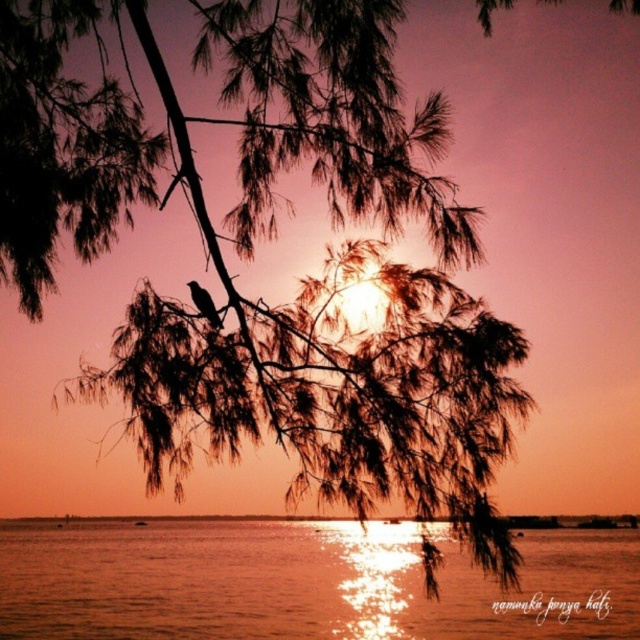
Question: Among these objects, which one is farthest from the camera?

Choices:
 (A) brown feathered bird at upper left
 (B) shiny reflective water at center

Answer: (A)

Question: Is shiny reflective water at center below brown feathered bird at upper left?

Choices:
 (A) no
 (B) yes

Answer: (B)

Question: Can you confirm if shiny reflective water at center is thinner than brown feathered bird at upper left?

Choices:
 (A) yes
 (B) no

Answer: (B)

Question: Does shiny reflective water at center appear under brown feathered bird at upper left?

Choices:
 (A) no
 (B) yes

Answer: (B)

Question: Which point appears farthest from the camera in this image?

Choices:
 (A) (193, 285)
 (B) (456, 625)

Answer: (B)

Question: Which object is farther from the camera taking this photo?

Choices:
 (A) brown feathered bird at upper left
 (B) shiny reflective water at center

Answer: (A)